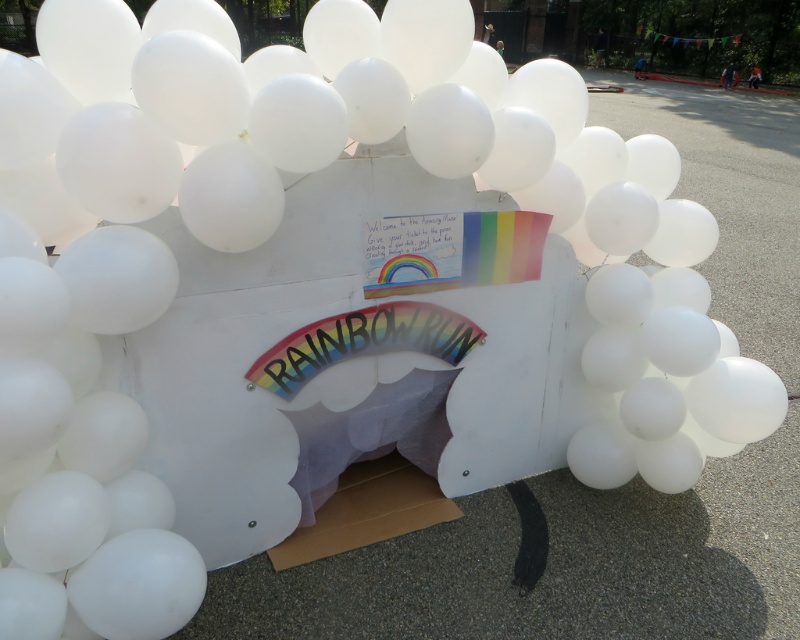
You are organizing the Rainbow Run event and need to place a decorative banner. The banner must be visible to participants entering through the tunnel. Which object should the banner be attached to, the white cardboard box at center or the cardboard at center?

The banner should be attached to the white cardboard box at center because it is in front of the cardboard at center, making it more visible to participants entering through the tunnel.

You are a photographer holding a camera. You want to take a photo of the white cardboard box at center from a distance where you can clearly see all its details. Given that the minimum focusing distance of your camera is 1.5 meters, can you stand at the current position and take the photo?

The white cardboard box at center and camera are 1.63 meters apart. Since the minimum focusing distance of your camera is 1.5 meters, you can stand at the current position and take the photo because 1.63 meters is greater than 1.5 meters.

Based on the photo, wait, the objects are the same? The description says the white cardboard box at center might be wider than the cardboard at center. But aren t they the same object? How can one be wider than the other?

The white cardboard box at center and the cardboard at center are two distinct objects. The white cardboard box at center might be wider than the cardboard at center.